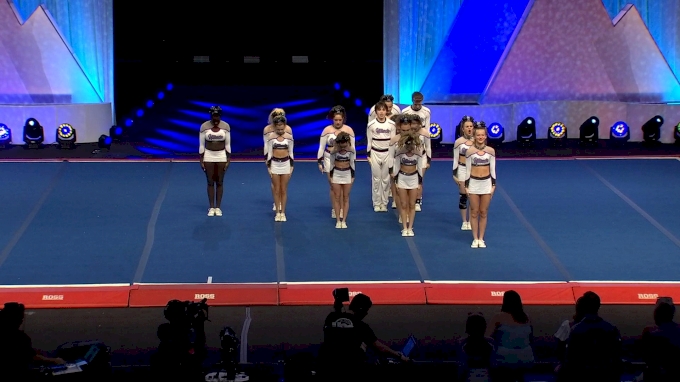
The width and height of the screenshot is (680, 382). I want to click on stage lights at right, so click(x=532, y=128), click(x=559, y=131), click(x=577, y=127), click(x=612, y=125), click(x=643, y=127), click(x=496, y=125), click(x=432, y=127).